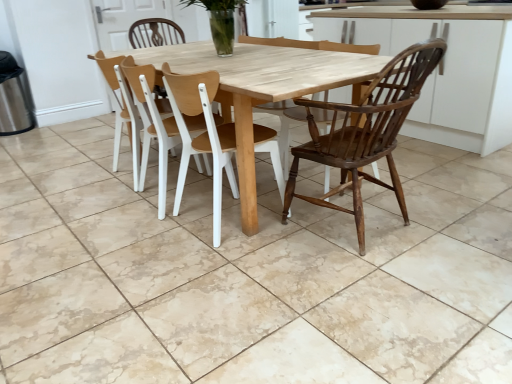
Question: Is wooden at center, which ranks as the third chair in right-to-left order, at the left side of light wood table at center?

Choices:
 (A) yes
 (B) no

Answer: (A)

Question: Is wooden at center, arranged as the first chair when viewed from the left, oriented towards light wood table at center?

Choices:
 (A) yes
 (B) no

Answer: (A)

Question: Is wooden at center, arranged as the first chair when viewed from the left, next to light wood table at center and touching it?

Choices:
 (A) no
 (B) yes

Answer: (A)

Question: Is wooden at center, arranged as the first chair when viewed from the left, taller than light wood table at center?

Choices:
 (A) no
 (B) yes

Answer: (B)

Question: Can you confirm if wooden at center, arranged as the first chair when viewed from the left, is wider than light wood table at center?

Choices:
 (A) no
 (B) yes

Answer: (A)

Question: Can you confirm if wooden at center, arranged as the first chair when viewed from the left, is bigger than light wood table at center?

Choices:
 (A) no
 (B) yes

Answer: (A)

Question: From the image's perspective, is light wood table at center located above dark brown wood chair at right, marked as the third chair in a left-to-right arrangement?

Choices:
 (A) yes
 (B) no

Answer: (A)

Question: Is light wood table at center thinner than dark brown wood chair at right, marked as the third chair in a left-to-right arrangement?

Choices:
 (A) no
 (B) yes

Answer: (A)

Question: Is light wood table at center wider than dark brown wood chair at right, marked as the third chair in a left-to-right arrangement?

Choices:
 (A) no
 (B) yes

Answer: (B)

Question: Is light wood table at center aimed at dark brown wood chair at right, marked as the third chair in a left-to-right arrangement?

Choices:
 (A) yes
 (B) no

Answer: (B)

Question: From a real-world perspective, does light wood table at center sit lower than dark brown wood chair at right, marked as the third chair in a left-to-right arrangement?

Choices:
 (A) no
 (B) yes

Answer: (B)

Question: Would you consider light wood table at center to be distant from dark brown wood chair at right, marked as the third chair in a left-to-right arrangement?

Choices:
 (A) no
 (B) yes

Answer: (A)

Question: Can you confirm if light wood table at center is shorter than clear glass vase at center?

Choices:
 (A) yes
 (B) no

Answer: (B)